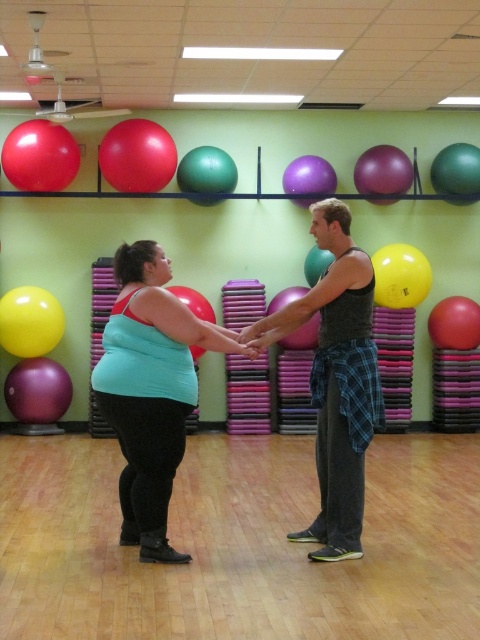
Between matte teal tank top at center and rubber exercise ball at center, which one appears on the right side from the viewer's perspective?

Positioned to the right is rubber exercise ball at center.

Identify the location of matte teal tank top at center. The image size is (480, 640). (196, 380).

Who is more distant from viewer, (157,449) or (273,308)?

The point (273,308) is more distant.

Identify the location of matte teal tank top at center. Image resolution: width=480 pixels, height=640 pixels. (196, 380).

Does teal fabric shirt at center lie in front of rubberized red ball at center?

Yes, it is.

This screenshot has height=640, width=480. I want to click on teal fabric shirt at center, so click(x=151, y=390).

The width and height of the screenshot is (480, 640). I want to click on teal fabric shirt at center, so (x=151, y=390).

Who is positioned more to the right, yellow matte balloon at upper center or green rubber ball at center?

From the viewer's perspective, yellow matte balloon at upper center appears more on the right side.

Can you confirm if yellow matte balloon at upper center is positioned below green rubber ball at center?

Yes.

From the picture: Who is more forward, (x=386, y=276) or (x=214, y=168)?

Point (x=214, y=168) is in front.

Find the location of a particular element. The height and width of the screenshot is (640, 480). yellow matte balloon at upper center is located at coordinates [400, 275].